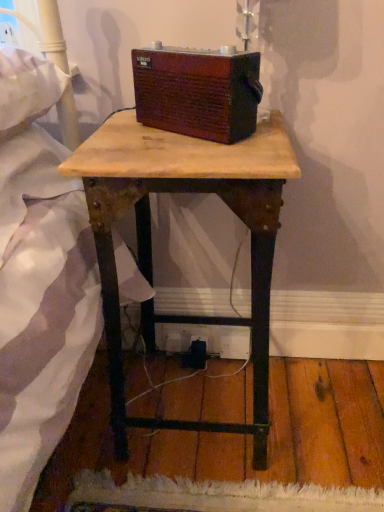
At what (x,y) coordinates should I click in order to perform the action: click on vacant region to the left of wooden table at center. Please return your answer as a coordinate pair (x, y). This screenshot has height=512, width=384. Looking at the image, I should click on (100, 428).